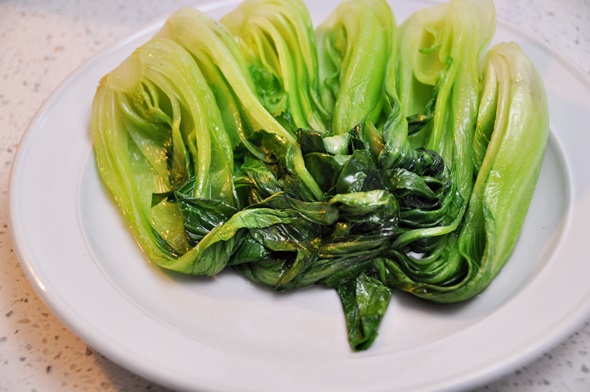
This screenshot has height=392, width=590. Find the location of `counter`. counter is located at coordinates (35, 63).